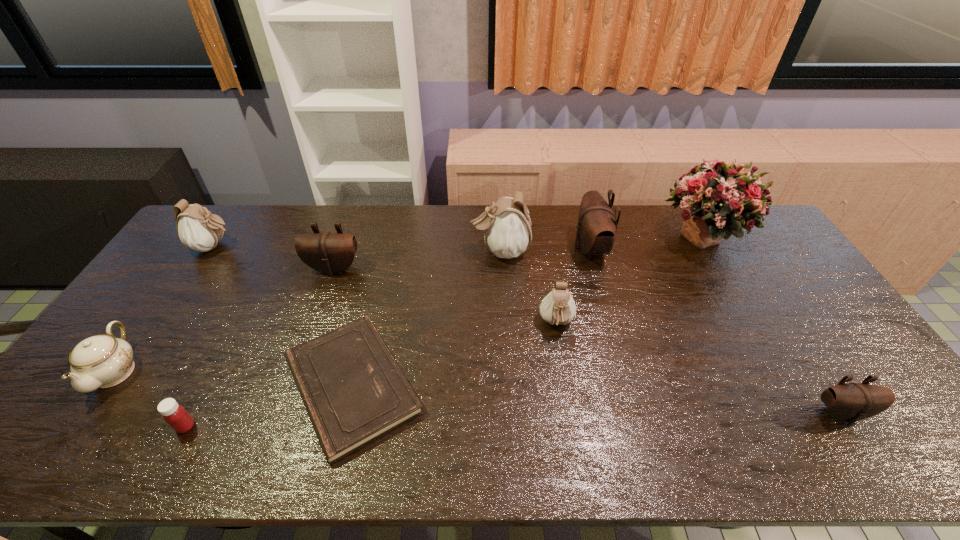
Where is `vacant space at the far edge`? This screenshot has width=960, height=540. vacant space at the far edge is located at coordinates (415, 246).

The width and height of the screenshot is (960, 540). In the image, there is a desktop. Find the location of `vacant space at the near edge`. vacant space at the near edge is located at coordinates (541, 443).

This screenshot has width=960, height=540. In the image, there is a desktop. What are the coordinates of `vacant space at the left edge` in the screenshot? It's located at (x=129, y=335).

Locate an element on the screen. This screenshot has width=960, height=540. vacant space at the right edge of the desktop is located at coordinates (756, 284).

The width and height of the screenshot is (960, 540). Find the location of `free point between the biggest white pouch and the nearest white pouch`. free point between the biggest white pouch and the nearest white pouch is located at coordinates (528, 287).

I want to click on free space between the eighth object from left to right and the smallest white pouch, so click(573, 286).

Where is `vacant point located between the second brown pouch from left to right and the rightmost brown pouch`? This screenshot has width=960, height=540. vacant point located between the second brown pouch from left to right and the rightmost brown pouch is located at coordinates 715,330.

At what (x,y) coordinates should I click in order to perform the action: click on vacant space that's between the rightmost brown pouch and the paperback book. Please return your answer as a coordinate pair (x, y). This screenshot has height=540, width=960. Looking at the image, I should click on (596, 399).

The width and height of the screenshot is (960, 540). In order to click on free space between the smallest white pouch and the pink bouquet in this screenshot , I will do `click(631, 281)`.

Where is `vacant region between the chinaware and the medicine`? vacant region between the chinaware and the medicine is located at coordinates (151, 399).